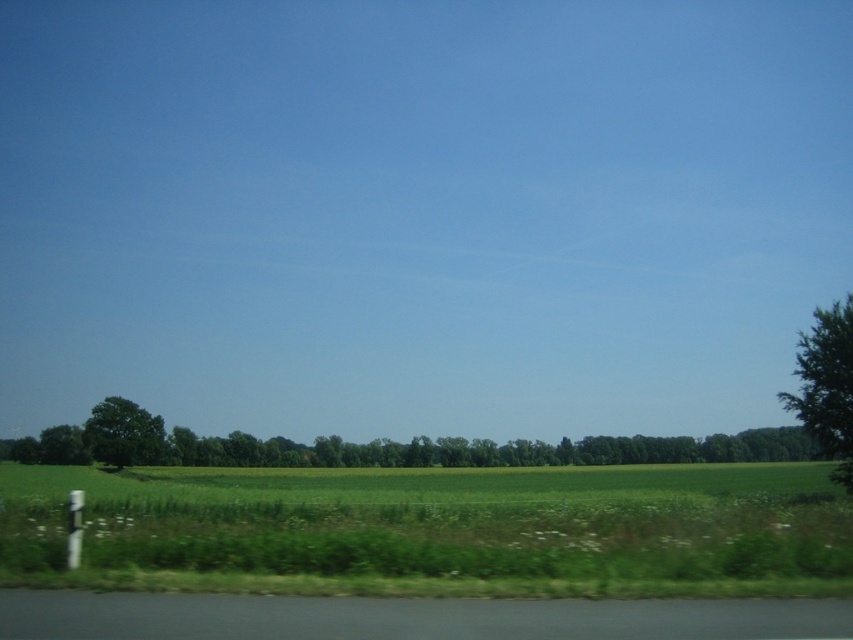
You are a farmer inspecting your crops. You notice two plants in the foreground of your field. One is green grass at lower center and the other is green leafy tree at lower center. Which of these two plants has a thicker stem or trunk?

The green leafy tree at lower center has a thicker trunk than the green grass at lower center.

From the picture: You are a farmer planning to plant new crops in the cultivated land. You notice the green grass at lower center and the green leafy tree at right in the image. Which area has a wider spread between these two?

The green grass at lower center has a wider spread than the green leafy tree at right as per the description.

You are a farmer inspecting your crops from a drone. You notice two elements in the lower center of the image. Which one takes up more space, the green grass at lower center or the green leafy tree at lower center?

The green leafy tree at lower center occupies more space than the green grass at lower center.